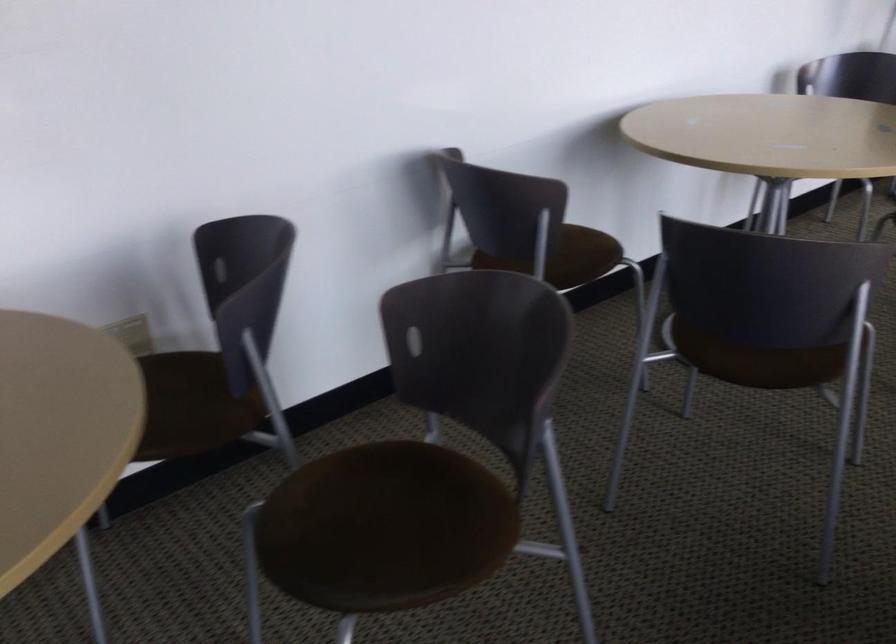
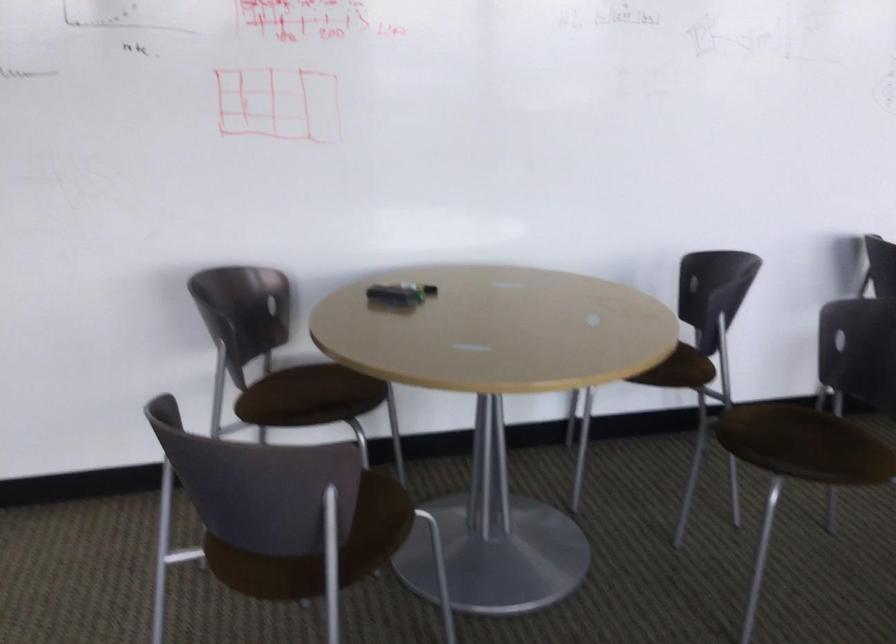
Where in the second image is the point corresponding to (x=407, y=511) from the first image?

(798, 437)